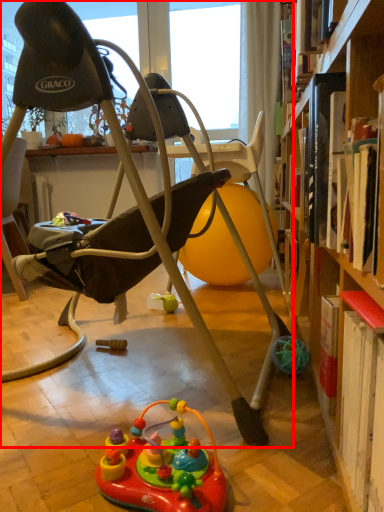
Question: From the image, what is the correct spatial relationship of chair (annotated by the red box) in relation to toy?

Choices:
 (A) left
 (B) right

Answer: (A)